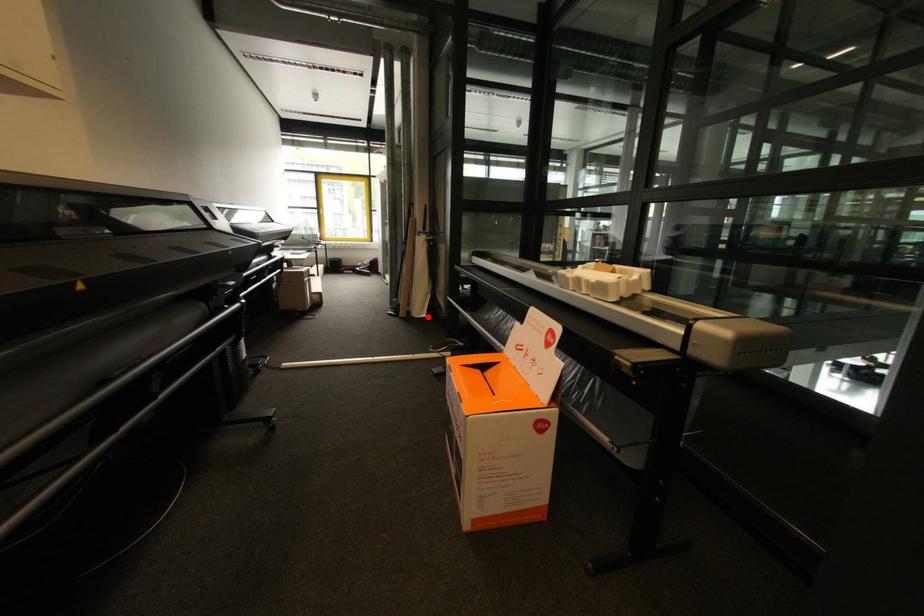
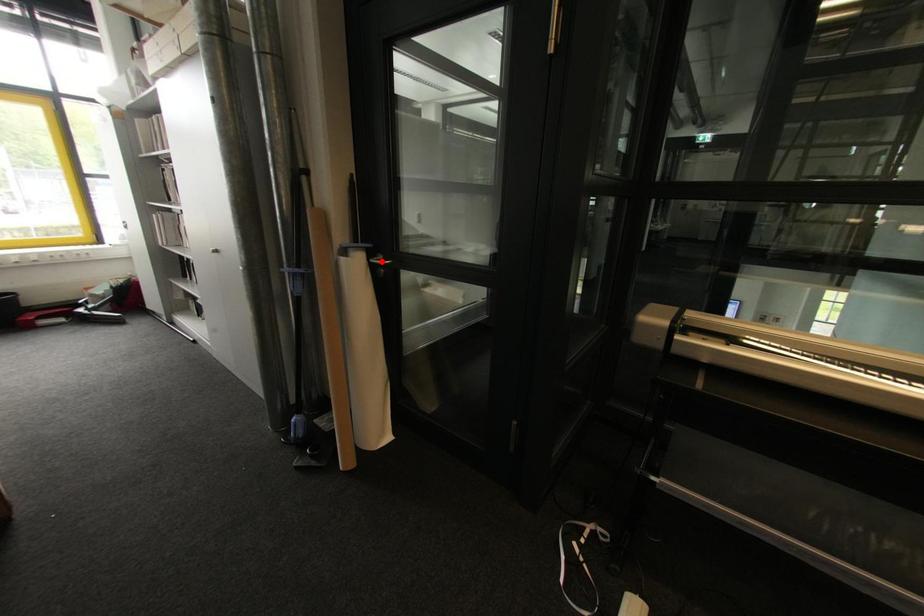
I am providing you with two images of the same scene from different viewpoints. A red point is marked on the first image and another point is marked on the second image. Are the points marked in image1 and image2 representing the same 3D position?

No